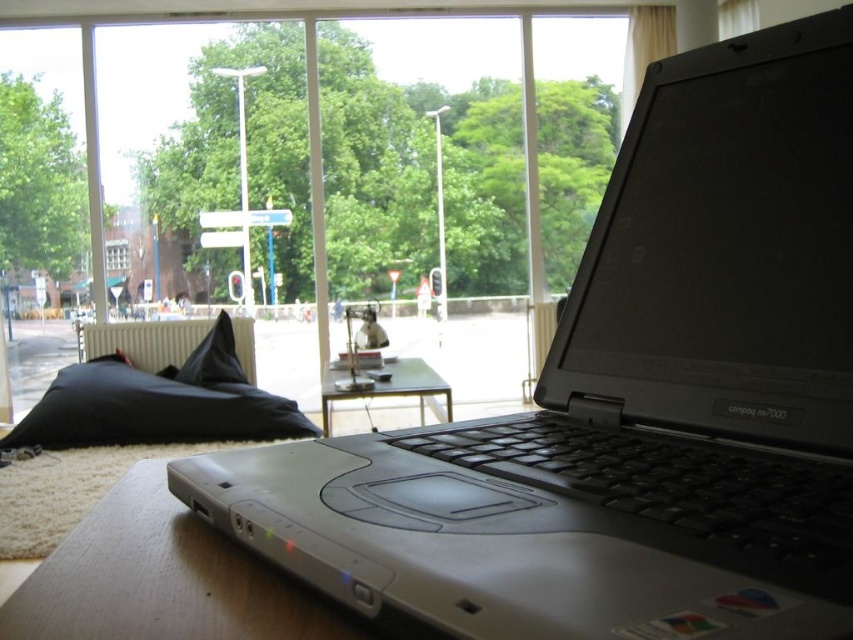
Question: Which object is the farthest from the transparent glass window at center?

Choices:
 (A) clear glass table at center
 (B) black fabric pillow at left
 (C) black fabric pillow at center
 (D) clear glass window at center

Answer: (A)

Question: Which of the following is the closest to the observer?

Choices:
 (A) (546, 321)
 (B) (332, 384)
 (C) (83, 435)
 (D) (125, 248)

Answer: (B)

Question: Considering the real-world distances, which object is farthest from the black fabric pillow at left?

Choices:
 (A) black fabric pillow at center
 (B) transparent glass window at center

Answer: (B)

Question: Is black fabric pillow at left below clear glass table at center?

Choices:
 (A) yes
 (B) no

Answer: (A)

Question: Is clear glass table at center to the right of clear glass window at center from the viewer's perspective?

Choices:
 (A) no
 (B) yes

Answer: (B)

Question: Does black fabric pillow at left come in front of clear glass window at center?

Choices:
 (A) yes
 (B) no

Answer: (A)